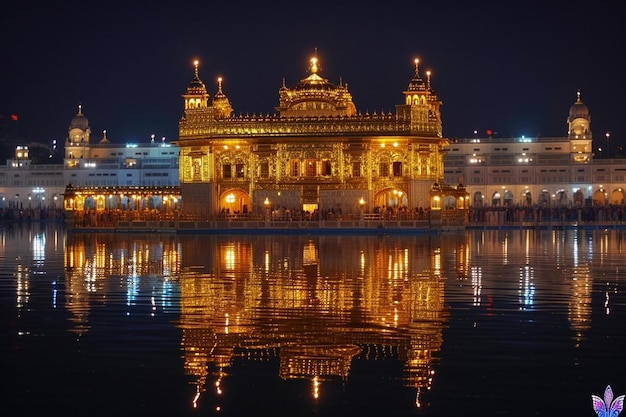
Where is `vestibule`? The image size is (626, 417). vestibule is located at coordinates (240, 193), (391, 196).